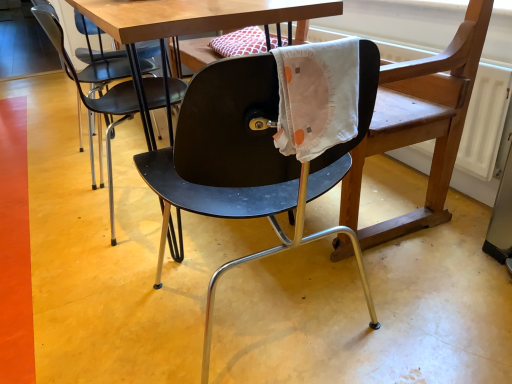
At what (x,y) coordinates should I click in order to perform the action: click on vacant area to the right of matte black chair at center, marked as the 1th chair in a right-to-left arrangement. Please return your answer as a coordinate pair (x, y). Looking at the image, I should click on (424, 299).